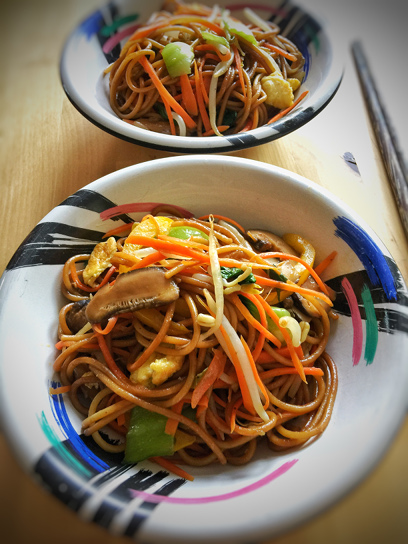
This screenshot has height=544, width=408. I want to click on ceramic bowl, so click(229, 187), click(209, 146).